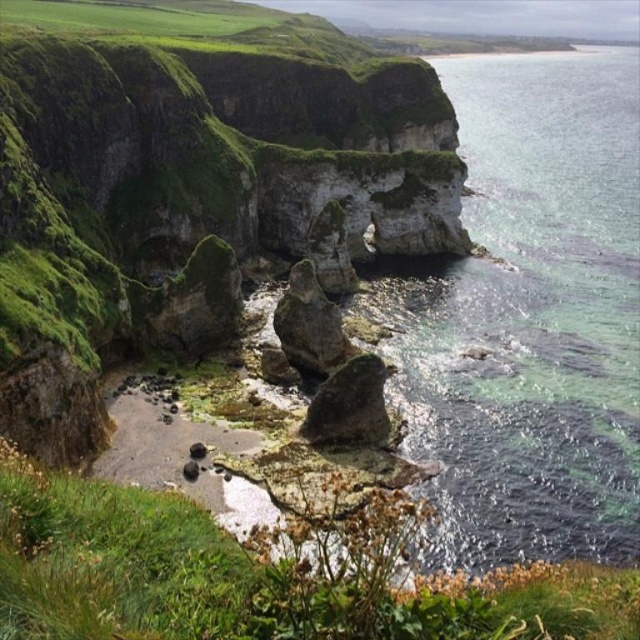
Question: Among these points, which one is nearest to the camera?

Choices:
 (A) (561, 346)
 (B) (314, 353)
 (C) (353, 420)
 (D) (356, 76)

Answer: (C)

Question: Which object is farther from the camera taking this photo?

Choices:
 (A) green mossy rock formation at center
 (B) dark gray rock at center

Answer: (B)

Question: Where is green mossy rock formation at center located in relation to dark gray rock at center in the image?

Choices:
 (A) left
 (B) right

Answer: (A)

Question: Is the position of green mossy rock formation at center less distant than that of rough textured rock at center?

Choices:
 (A) yes
 (B) no

Answer: (A)

Question: Can you confirm if clear water at lower right is smaller than rough textured rock at center?

Choices:
 (A) no
 (B) yes

Answer: (A)

Question: Which is nearer to the dark gray rock at center?

Choices:
 (A) rough textured rock at center
 (B) green mossy rock formation at center
 (C) clear water at lower right

Answer: (A)